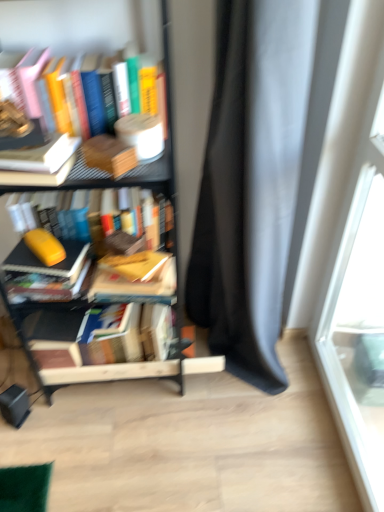
Describe the element at coordinates (355, 253) in the screenshot. I see `transparent glass window at right` at that location.

At what (x,y) coordinates should I click in order to perform the action: click on yellow matte book at left, the 1th paperback book in the bottom-to-top sequence. Please return your answer as a coordinate pair (x, y). This screenshot has width=384, height=512. Looking at the image, I should click on (45, 246).

Can you tell me how much wooden at left, the 2th paperback book in the back-to-front sequence, and white matte book at upper left, arranged as the fifth book when ordered from the bottom, differ in facing direction?

The angle between the facing direction of wooden at left, the 2th paperback book in the back-to-front sequence, and the facing direction of white matte book at upper left, arranged as the fifth book when ordered from the bottom, is 29.4 degrees.

Is wooden at left, marked as the first paperback book in a top-to-bottom arrangement, to the right of white matte book at upper left, the 2th book positioned from the top, from the viewer's perspective?

Yes.

Can you confirm if wooden at left, marked as the first paperback book in a top-to-bottom arrangement, is taller than white matte book at upper left, the 2th book positioned from the top?

In fact, wooden at left, marked as the first paperback book in a top-to-bottom arrangement, may be shorter than white matte book at upper left, the 2th book positioned from the top.

Based on the photo, looking at their sizes, would you say yellow matte book at center, the 4th book viewed from the top, is wider or thinner than white matte book at upper left, the 2th book positioned from the top?

Considering their sizes, yellow matte book at center, the 4th book viewed from the top, looks slimmer than white matte book at upper left, the 2th book positioned from the top.

Considering the relative sizes of yellow matte book at center, the 4th book viewed from the top, and white matte book at upper left, arranged as the fifth book when ordered from the bottom, in the image provided, is yellow matte book at center, the 4th book viewed from the top, smaller than white matte book at upper left, arranged as the fifth book when ordered from the bottom,?

No.

Could you measure the distance between yellow matte book at center, the third book positioned from the bottom, and white matte book at upper left, arranged as the fifth book when ordered from the bottom?

yellow matte book at center, the third book positioned from the bottom, and white matte book at upper left, arranged as the fifth book when ordered from the bottom, are 14.60 inches apart.

From the image's perspective, is yellow matte book at center, the third book positioned from the bottom, on white matte book at upper left, arranged as the fifth book when ordered from the bottom?

No, from the image's perspective, yellow matte book at center, the third book positioned from the bottom, is not above white matte book at upper left, arranged as the fifth book when ordered from the bottom.

Does point (140, 279) come in front of point (220, 8)?

No, (140, 279) is behind (220, 8).

Is yellow matte book at center, the third book positioned from the bottom, taller than matte gray curtain at right?

Incorrect, the height of yellow matte book at center, the third book positioned from the bottom, is not larger of that of matte gray curtain at right.

Based on the photo, from the image's perspective, who appears lower, yellow matte book at center, the 4th book viewed from the top, or matte gray curtain at right?

yellow matte book at center, the 4th book viewed from the top, is shown below in the image.

How different are the orientations of yellow matte book at center, the third book positioned from the bottom, and matte gray curtain at right in degrees?

They differ by 85.4 degrees in their facing directions.

Is orange matte book at center, which appears as the fourth book when ordered from the bottom, outside of hardcover book at upper left, positioned as the 1th book in top-to-bottom order?

orange matte book at center, which appears as the fourth book when ordered from the bottom, lies outside hardcover book at upper left, positioned as the 1th book in top-to-bottom order,'s area.

Considering the relative sizes of orange matte book at center, which appears as the fourth book when ordered from the bottom, and hardcover book at upper left, positioned as the 1th book in top-to-bottom order, in the image provided, is orange matte book at center, which appears as the fourth book when ordered from the bottom, taller than hardcover book at upper left, positioned as the 1th book in top-to-bottom order,?

Correct, orange matte book at center, which appears as the fourth book when ordered from the bottom, is much taller as hardcover book at upper left, positioned as the 1th book in top-to-bottom order.

Is orange matte book at center, which appears as the fourth book when ordered from the bottom, not close to hardcover book at upper left, arranged as the 6th book when ordered from the bottom?

No, orange matte book at center, which appears as the fourth book when ordered from the bottom, is in close proximity to hardcover book at upper left, arranged as the 6th book when ordered from the bottom.

Is point (12, 218) farther from viewer compared to point (62, 129)?

Yes, point (12, 218) is behind point (62, 129).

Between orange matte book at center, which appears as the fourth book when ordered from the bottom, and yellow matte book at center, the 4th book viewed from the top, which one has less height?

Standing shorter between the two is yellow matte book at center, the 4th book viewed from the top.

Looking at this image, is orange matte book at center, which appears as the fourth book when ordered from the bottom, wider than yellow matte book at center, the 4th book viewed from the top?

Yes.

Which is further, (168, 213) or (133, 263)?

The point (168, 213) is more distant.

From a real-world perspective, is hardcover book at upper left, positioned as the 1th book in top-to-bottom order, positioned above or below yellow matte book at left, the 1th paperback book viewed from the back?

hardcover book at upper left, positioned as the 1th book in top-to-bottom order, is above yellow matte book at left, the 1th paperback book viewed from the back.

Is hardcover book at upper left, positioned as the 1th book in top-to-bottom order, situated inside yellow matte book at left, which is the first paperback book from left to right, or outside?

hardcover book at upper left, positioned as the 1th book in top-to-bottom order, is not inside yellow matte book at left, which is the first paperback book from left to right, it's outside.

Could you tell me if hardcover book at upper left, positioned as the 1th book in top-to-bottom order, is turned towards yellow matte book at left, the 1th paperback book viewed from the back?

No, hardcover book at upper left, positioned as the 1th book in top-to-bottom order, does not turn towards yellow matte book at left, the 1th paperback book viewed from the back.

Can you confirm if hardcover book at upper left, positioned as the 1th book in top-to-bottom order, is taller than yellow matte book at left, which ranks as the second paperback book in front-to-back order?

Yes, hardcover book at upper left, positioned as the 1th book in top-to-bottom order, is taller than yellow matte book at left, which ranks as the second paperback book in front-to-back order.

Is white matte book at upper left, arranged as the fifth book when ordered from the bottom, not near yellow matte book at left, the 1th paperback book viewed from the back?

white matte book at upper left, arranged as the fifth book when ordered from the bottom, is near yellow matte book at left, the 1th paperback book viewed from the back, not far away.

Looking at this image, from a real-world perspective, is white matte book at upper left, arranged as the fifth book when ordered from the bottom, located higher than yellow matte book at left, the 1th paperback book in the bottom-to-top sequence?

Indeed, from a real-world perspective, white matte book at upper left, arranged as the fifth book when ordered from the bottom, stands above yellow matte book at left, the 1th paperback book in the bottom-to-top sequence.

Is point (35, 173) closer or farther from the camera than point (36, 255)?

Point (35, 173).

Does white matte book at upper left, arranged as the fifth book when ordered from the bottom, have a greater height compared to yellow matte book at left, which is the 2th paperback book in right-to-left order?

Correct, white matte book at upper left, arranged as the fifth book when ordered from the bottom, is much taller as yellow matte book at left, which is the 2th paperback book in right-to-left order.

The image size is (384, 512). I want to click on book in front of the wooden at left, marked as the first paperback book in a top-to-bottom arrangement, so coord(39,164).

Image resolution: width=384 pixels, height=512 pixels. In order to click on book that is the 2nd one above the yellow matte book at center, the third book positioned from the bottom (from a real-world perspective) in this screenshot , I will do `click(39, 164)`.

Looking at the image, which one is located closer to hardcover book at center, the sixth book viewed from the top, wooden at left, the 2th paperback book in the back-to-front sequence, or yellow matte book at left, which is the 2th paperback book in right-to-left order?

yellow matte book at left, which is the 2th paperback book in right-to-left order.

From the image, which object appears to be farther from matte gray curtain at right, yellow matte book at left, which is the 2th paperback book in right-to-left order, or transparent glass window at right?

Based on the image, yellow matte book at left, which is the 2th paperback book in right-to-left order, appears to be further to matte gray curtain at right.

Estimate the real-world distances between objects in this image. Which object is closer to wooden at left, the 2th paperback book in the back-to-front sequence, transparent glass window at right or yellow matte book at center, the third book positioned from the bottom?

Based on the image, yellow matte book at center, the third book positioned from the bottom, appears to be nearer to wooden at left, the 2th paperback book in the back-to-front sequence.

From the image, which object appears to be nearer to matte yellow book at left, the 2th book from the bottom, orange matte book at center, which appears as the fourth book when ordered from the bottom, or wooden at left, the second paperback book in the left-to-right sequence?

Among the two, wooden at left, the second paperback book in the left-to-right sequence, is located nearer to matte yellow book at left, the 2th book from the bottom.

Considering their positions, is matte yellow book at left, which appears as the 5th book when viewed from the top, positioned further to transparent glass window at right than white matte book at upper left, the 2th book positioned from the top?

Among the two, white matte book at upper left, the 2th book positioned from the top, is located further to transparent glass window at right.

Based on their spatial positions, is orange matte book at center, which appears as the fourth book when ordered from the bottom, or hardcover book at center, the sixth book viewed from the top, further from metallic black bookcase at left?

Among the two, hardcover book at center, the sixth book viewed from the top, is located further to metallic black bookcase at left.

When comparing their distances from wooden at left, the 2th paperback book in the back-to-front sequence, does yellow matte book at center, the third book positioned from the bottom, or matte yellow book at left, which appears as the 5th book when viewed from the top, seem further?

Among the two, matte yellow book at left, which appears as the 5th book when viewed from the top, is located further to wooden at left, the 2th paperback book in the back-to-front sequence.

Looking at this image, based on their spatial positions, is hardcover book at center, the sixth book viewed from the top, or orange matte book at center, which appears as the fourth book when ordered from the bottom, closer to matte gray curtain at right?

orange matte book at center, which appears as the fourth book when ordered from the bottom.

Where is `curtain between white matte book at upper left, arranged as the fifth book when ordered from the bottom, and transparent glass window at right from left to right`? This screenshot has height=512, width=384. curtain between white matte book at upper left, arranged as the fifth book when ordered from the bottom, and transparent glass window at right from left to right is located at coordinates (251, 184).

Identify the location of paperback book that lies between wooden at left, the 1th paperback book positioned from the right, and matte yellow book at left, the 2th book from the bottom, from top to bottom. (45, 246).

What are the coordinates of `paperback book between white matte book at upper left, the 2th book positioned from the top, and matte yellow book at left, which appears as the 5th book when viewed from the top, in the up-down direction` in the screenshot? It's located at (45, 246).

Find the location of a particular element. bookcase between hardcover book at upper left, positioned as the 1th book in top-to-bottom order, and yellow matte book at center, the third book positioned from the bottom, in the vertical direction is located at coordinates (172, 115).